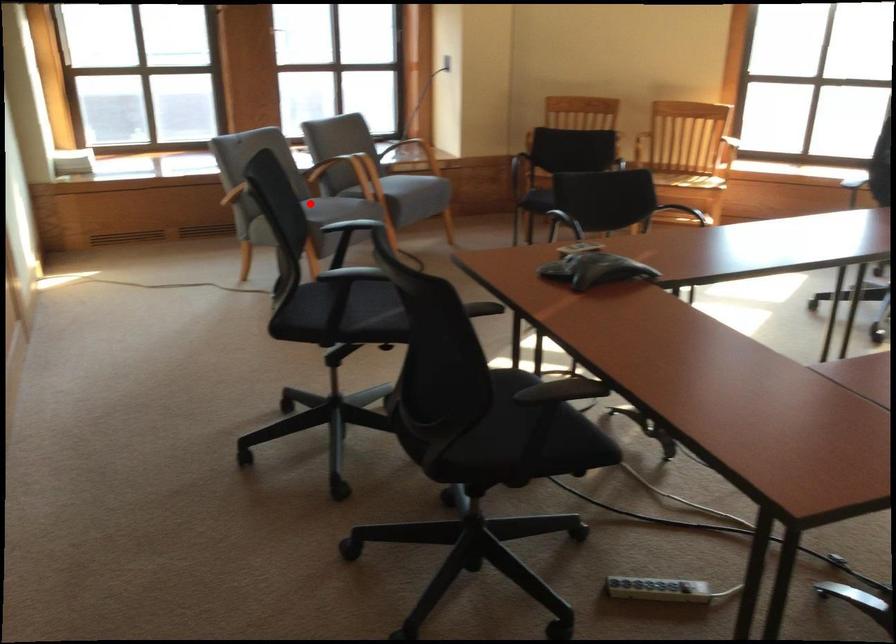
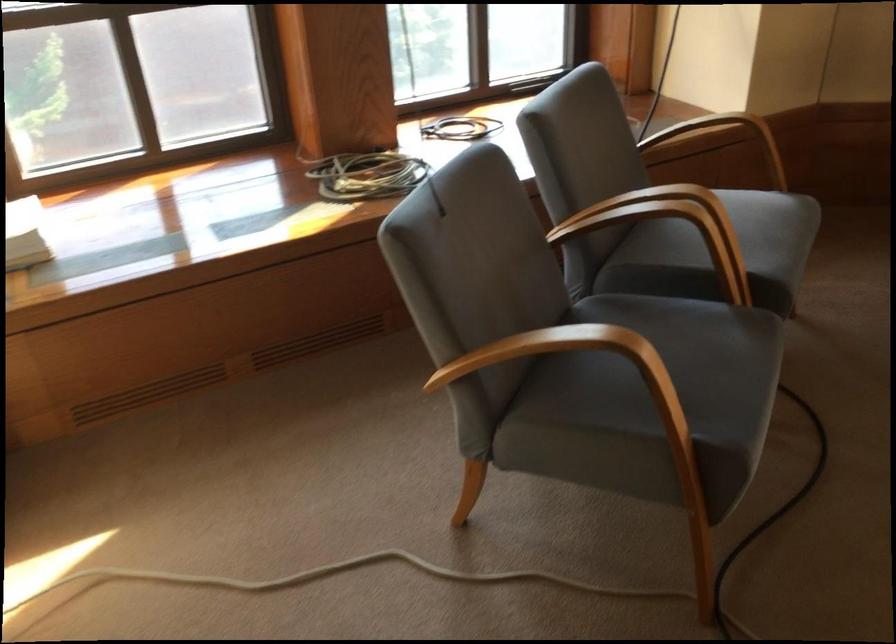
The point at the highlighted location is marked in the first image. Where is the corresponding point in the second image?

(650, 398)